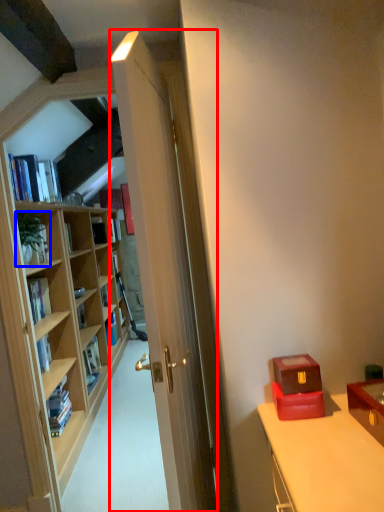
Question: Which point is closer to the camera, door (highlighted by a red box) or houseplant (highlighted by a blue box)?

Choices:
 (A) door
 (B) houseplant

Answer: (A)